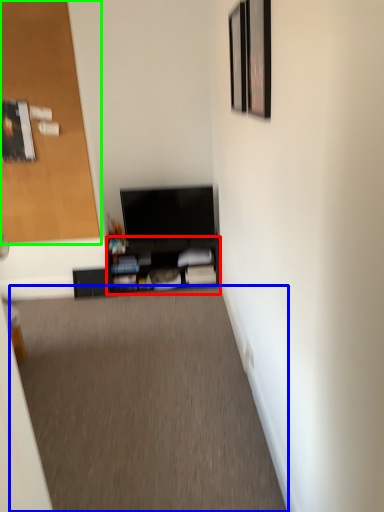
Question: Which object is the farthest from shelf (highlighted by a red box)? Choose among these: plain (highlighted by a blue box) or door (highlighted by a green box).

Choices:
 (A) plain
 (B) door

Answer: (A)